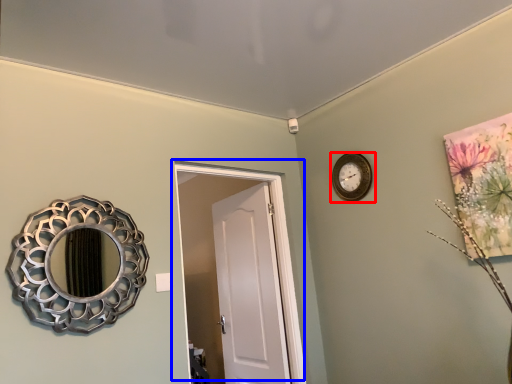
Question: Which object appears closest to the camera in this image, wall clock (highlighted by a red box) or door (highlighted by a blue box)?

Choices:
 (A) wall clock
 (B) door

Answer: (B)